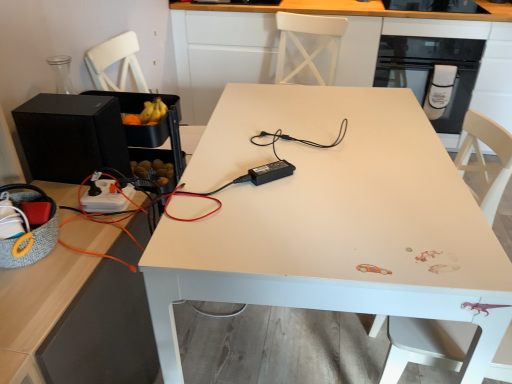
Question: Is white wood swivel chair at lower right outside white matte table at center?

Choices:
 (A) yes
 (B) no

Answer: (A)

Question: From a real-world perspective, is white wood swivel chair at lower right beneath white matte table at center?

Choices:
 (A) yes
 (B) no

Answer: (A)

Question: From the image's perspective, is white wood swivel chair at lower right on top of white matte table at center?

Choices:
 (A) no
 (B) yes

Answer: (A)

Question: Is white wood swivel chair at lower right oriented away from white matte table at center?

Choices:
 (A) no
 (B) yes

Answer: (A)

Question: Considering the relative positions of white wood swivel chair at lower right and white matte table at center in the image provided, is white wood swivel chair at lower right to the right of white matte table at center from the viewer's perspective?

Choices:
 (A) no
 (B) yes

Answer: (A)

Question: From the image's perspective, is white wood swivel chair at lower right located beneath white matte table at center?

Choices:
 (A) yes
 (B) no

Answer: (A)

Question: Is white matte table at center shorter than white matte table at center?

Choices:
 (A) no
 (B) yes

Answer: (B)

Question: Can you confirm if white matte table at center is positioned to the right of white matte table at center?

Choices:
 (A) no
 (B) yes

Answer: (A)

Question: Is white matte table at center far away from white matte table at center?

Choices:
 (A) no
 (B) yes

Answer: (B)

Question: Is white matte table at center with white matte table at center?

Choices:
 (A) no
 (B) yes

Answer: (A)

Question: Considering the relative sizes of white matte table at center and white matte table at center in the image provided, is white matte table at center wider than white matte table at center?

Choices:
 (A) yes
 (B) no

Answer: (A)

Question: Does white matte table at center appear on the left side of white matte table at center?

Choices:
 (A) yes
 (B) no

Answer: (A)

Question: Can you confirm if black glass door at upper right is thinner than white wood swivel chair at lower right?

Choices:
 (A) yes
 (B) no

Answer: (B)